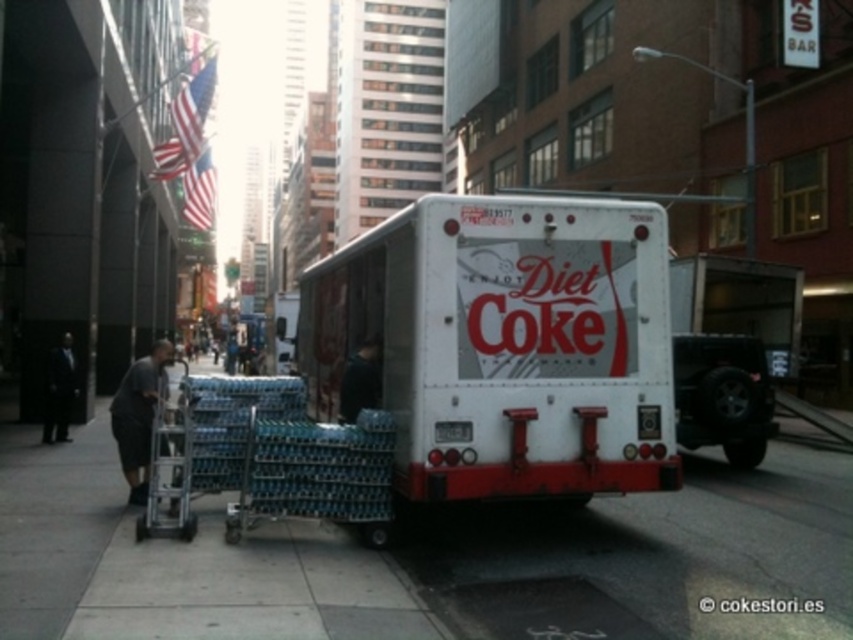
Does white concrete sidewalk at lower center come behind white matte truck at center?

No, it is not.

Identify the location of white concrete sidewalk at lower center. This screenshot has height=640, width=853. (422, 556).

This screenshot has width=853, height=640. Identify the location of white concrete sidewalk at lower center. (422, 556).